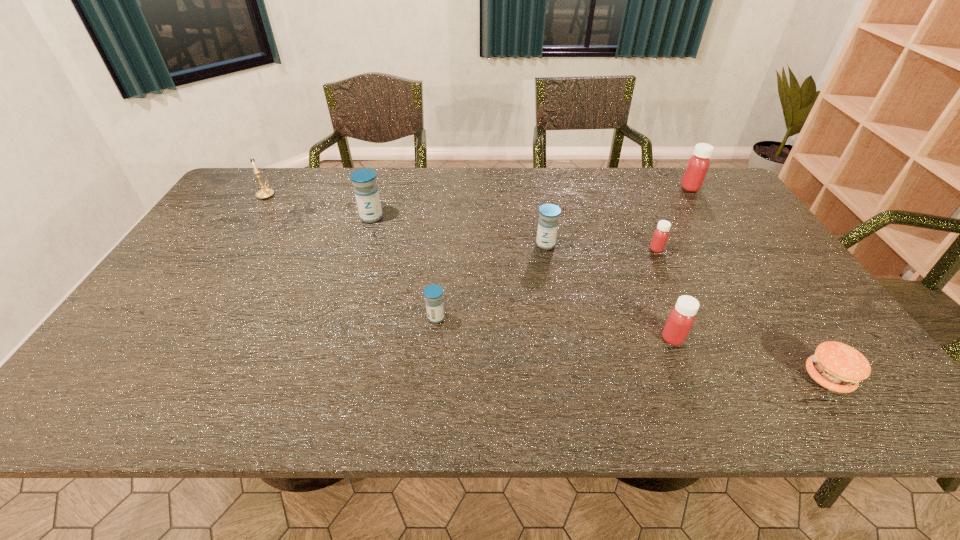
I want to click on patty that is at the right edge, so click(x=838, y=367).

I want to click on object at the far left corner, so coord(265,193).

I want to click on object at the far right corner, so click(x=698, y=164).

I want to click on object present at the near right corner, so click(x=838, y=367).

You are a GUI agent. You are given a task and a screenshot of the screen. Output one action in this format:
    pyautogui.click(x=<x>, y=<y>)
    Task: Click on the free space at the far edge
    
    Given the screenshot: What is the action you would take?
    pyautogui.click(x=311, y=199)

You are a GUI agent. You are given a task and a screenshot of the screen. Output one action in this format:
    pyautogui.click(x=<x>, y=<y>)
    Task: Click on the vacant space at the near edge
    Image resolution: width=960 pixels, height=540 pixels.
    Given the screenshot: What is the action you would take?
    pyautogui.click(x=257, y=393)

The height and width of the screenshot is (540, 960). In the image, there is a desktop. In order to click on vacant space at the left edge in this screenshot , I will do `click(247, 212)`.

You are a GUI agent. You are given a task and a screenshot of the screen. Output one action in this format:
    pyautogui.click(x=<x>, y=<y>)
    Task: Click on the blank area at the right edge
    Image resolution: width=960 pixels, height=540 pixels.
    Given the screenshot: What is the action you would take?
    pyautogui.click(x=748, y=286)

Locate an element on the screen. free space at the far left corner is located at coordinates (x=232, y=195).

This screenshot has height=540, width=960. Find the location of `free spot at the near right corner of the desktop`. free spot at the near right corner of the desktop is located at coordinates click(x=880, y=416).